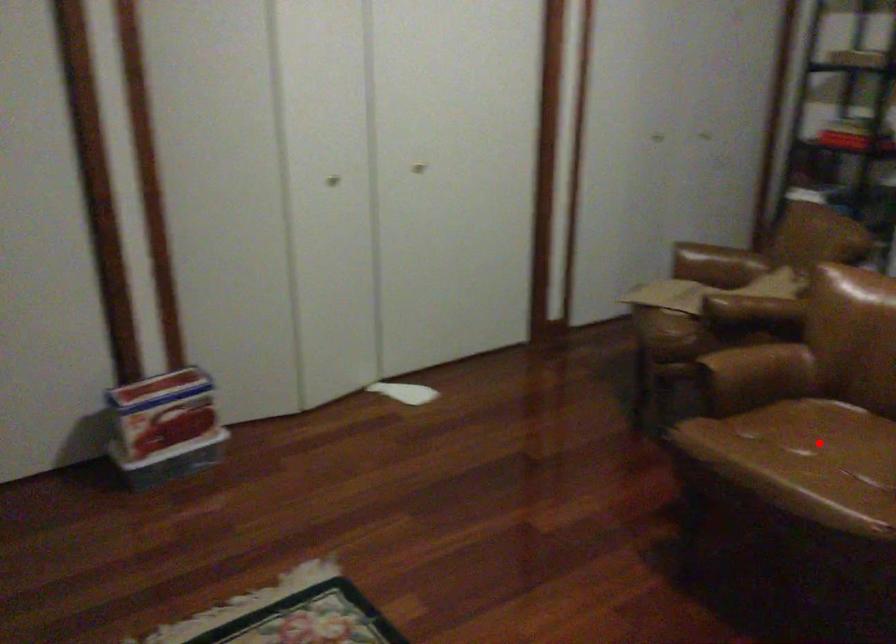
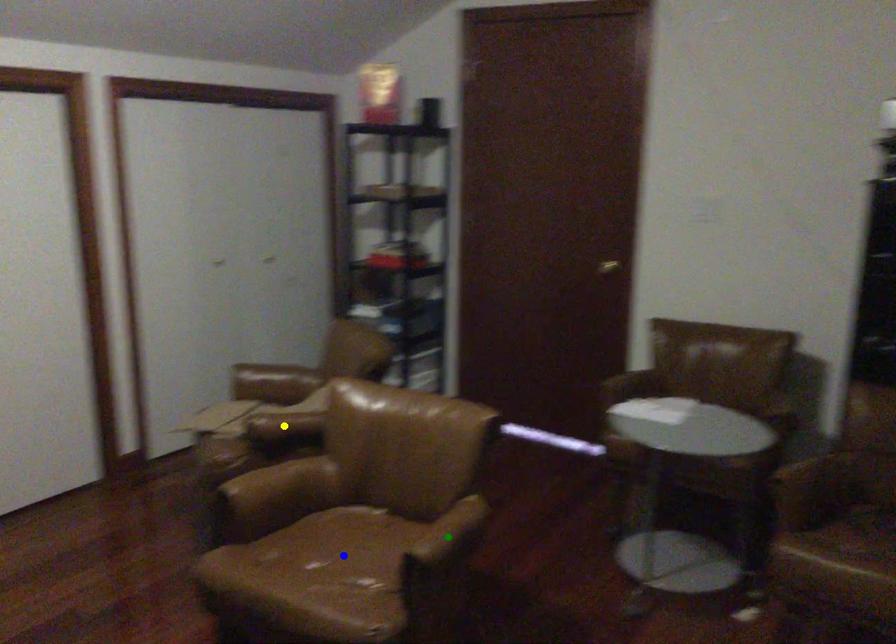
Question: I am providing you with two images of the same scene from different viewpoints. A red point is marked on the first image. You are given multiple points on the second image. Which point in image 2 represents the same 3d spot as the red point in image 1?

Choices:
 (A) blue point
 (B) green point
 (C) yellow point

Answer: (A)